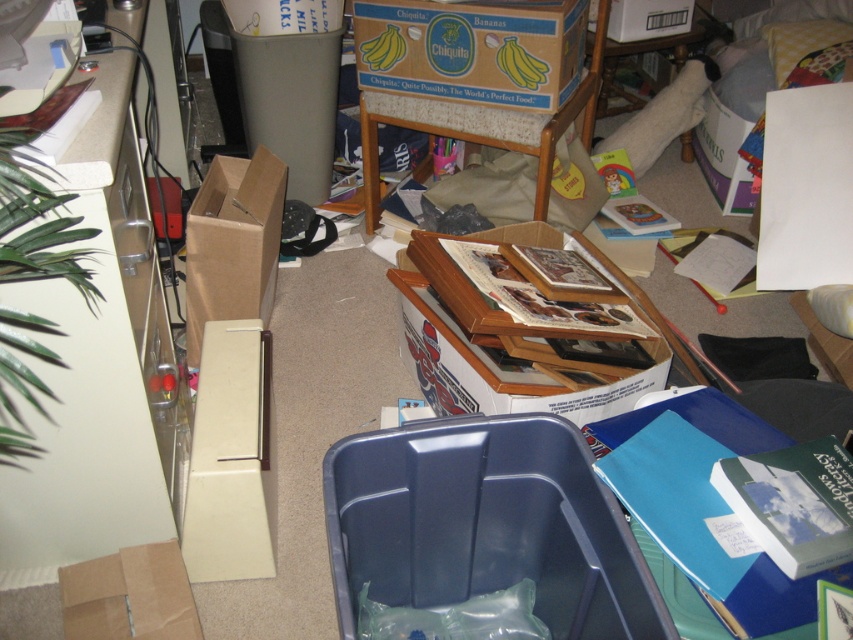
Is beige cardboard box at left further to camera compared to white cardboard box at center?

That is False.

Who is lower down, beige cardboard box at left or white cardboard box at center?

Positioned lower is beige cardboard box at left.

Image resolution: width=853 pixels, height=640 pixels. Identify the location of beige cardboard box at left. (230, 458).

Which is in front, point (247, 225) or point (660, 0)?

Point (247, 225) is in front.

This screenshot has height=640, width=853. In order to click on cardboard box at left in this screenshot , I will do `click(231, 243)`.

Which of these two, white cardboard box at center or brown paper bag at lower left, stands shorter?

With less height is brown paper bag at lower left.

Does point (576, 401) come behind point (154, 547)?

Yes, point (576, 401) is behind point (154, 547).

The height and width of the screenshot is (640, 853). I want to click on white cardboard box at center, so click(x=502, y=368).